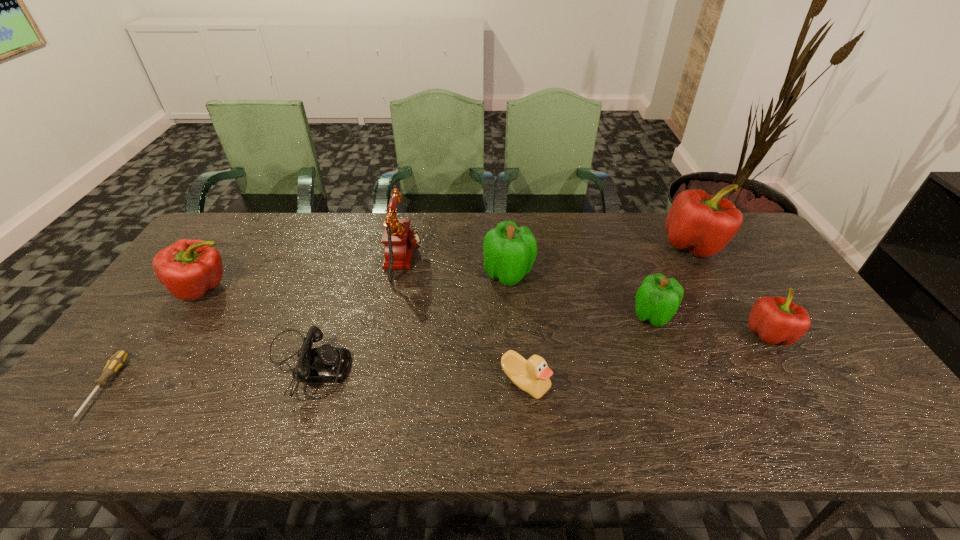
In the image, there is a desktop. Where is `free space at the far edge`? The height and width of the screenshot is (540, 960). free space at the far edge is located at coordinates (472, 245).

Locate an element on the screen. Image resolution: width=960 pixels, height=540 pixels. free space at the near edge of the desktop is located at coordinates (773, 436).

The width and height of the screenshot is (960, 540). I want to click on vacant space at the right edge, so click(793, 349).

Locate an element on the screen. This screenshot has width=960, height=540. vacant region at the far left corner is located at coordinates tap(241, 235).

You are a GUI agent. You are given a task and a screenshot of the screen. Output one action in this format:
    pyautogui.click(x=<x>, y=<y>)
    Task: Click on the free space that is in between the gray screwdriver and the smallest pink bell pepper
    
    Given the screenshot: What is the action you would take?
    pyautogui.click(x=437, y=361)

Find the location of a particular element. free area in between the biggest pink bell pepper and the right telephone is located at coordinates 548,253.

Locate an element on the screen. Image resolution: width=960 pixels, height=540 pixels. vacant area that lies between the smaller green bell pepper and the eighth tallest object is located at coordinates (479, 340).

The width and height of the screenshot is (960, 540). Identify the location of free space between the right green bell pepper and the screwdriver. (378, 352).

The image size is (960, 540). Find the location of `free spot between the shortest object and the second shortest object`. free spot between the shortest object and the second shortest object is located at coordinates (204, 376).

At what (x,y) coordinates should I click in order to perform the action: click on unoccupied position between the gray screwdriver and the farthest pink bell pepper. Please return your answer as a coordinate pair (x, y). Looking at the image, I should click on (398, 316).